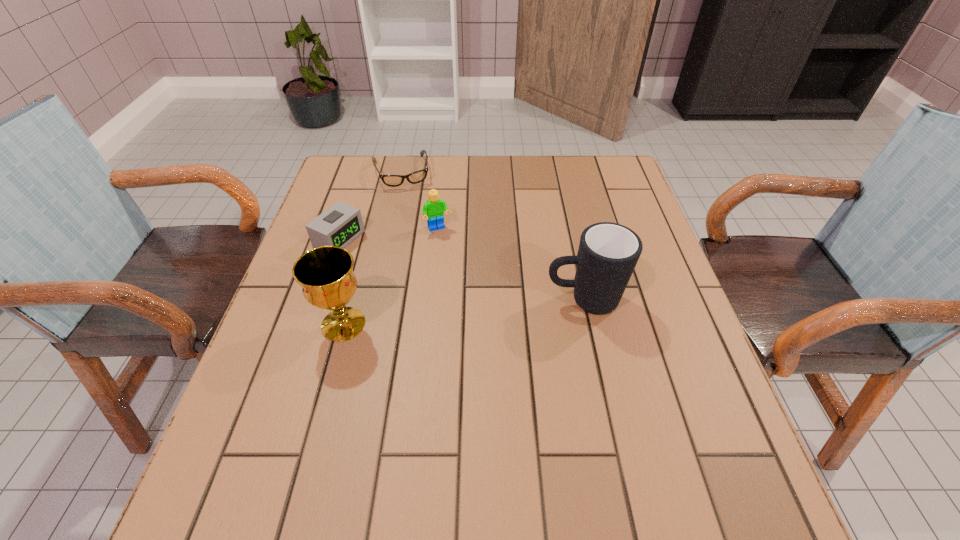
Select which object appears as the fourth closest to the mug. Please provide its 2D coordinates. Your answer should be formatted as a tuple, i.e. [(x, y)], where the tuple contains the x and y coordinates of a point satisfying the conditions above.

[(418, 176)]

You are a GUI agent. You are given a task and a screenshot of the screen. Output one action in this format:
    pyautogui.click(x=<x>, y=<y>)
    Task: Click on the closest object to the Lego
    The width and height of the screenshot is (960, 540).
    Given the screenshot: What is the action you would take?
    pyautogui.click(x=418, y=176)

Identify the location of vacant space that satisfies the following two spatial constraints: 1. on the front side of the shortest object; 2. on the side of the mug with the handle. (373, 300).